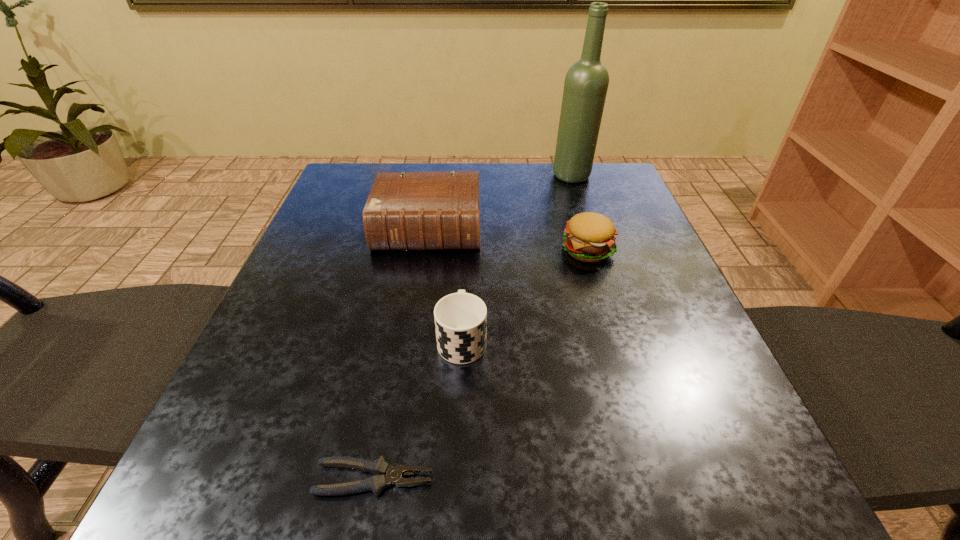
The image size is (960, 540). In order to click on the tallest object in this screenshot , I will do click(x=586, y=83).

I want to click on wine bottle, so click(x=586, y=83).

Identify the location of the second tallest object. (405, 211).

Identify the location of cup. The height and width of the screenshot is (540, 960). (460, 318).

At what (x,y) coordinates should I click in order to perform the action: click on hamburger. Please return your answer as a coordinate pair (x, y). This screenshot has width=960, height=540. Looking at the image, I should click on (589, 237).

At what (x,y) coordinates should I click in order to perform the action: click on the shortest object. Please return your answer as a coordinate pair (x, y). The height and width of the screenshot is (540, 960). Looking at the image, I should click on (378, 482).

Find the location of a particular element. The width and height of the screenshot is (960, 540). pliers is located at coordinates (378, 482).

This screenshot has width=960, height=540. In order to click on free spot located on the front of the wine bottle in this screenshot , I will do `click(602, 268)`.

Where is `vacant space located on the spine side of the Bible`? This screenshot has height=540, width=960. vacant space located on the spine side of the Bible is located at coordinates (414, 327).

At what (x,y) coordinates should I click in order to perform the action: click on free region located 0.070m on the side of the cup with the handle. Please return your answer as a coordinate pair (x, y). Looking at the image, I should click on (464, 289).